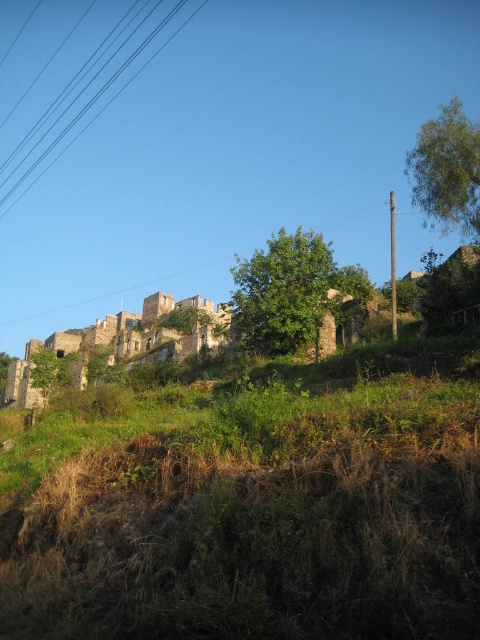
Question: Which of the following is the farthest from the observer?

Choices:
 (A) (410, 541)
 (B) (33, 408)
 (C) (105, 298)
 (D) (31, 136)

Answer: (D)

Question: Which object appears closest to the camera in this image?

Choices:
 (A) black wire at upper left
 (B) brown wooden power line at upper center

Answer: (B)

Question: Where is green grassy at upper left located in relation to brown wooden power line at upper center in the image?

Choices:
 (A) left
 (B) right

Answer: (B)

Question: Is black wire at upper left above brown wooden power line at upper center?

Choices:
 (A) no
 (B) yes

Answer: (B)

Question: Which point is closer to the camera?

Choices:
 (A) (24, 433)
 (B) (62, 337)

Answer: (A)

Question: Is black wire at upper left thinner than weathered stone castle at upper center?

Choices:
 (A) yes
 (B) no

Answer: (B)